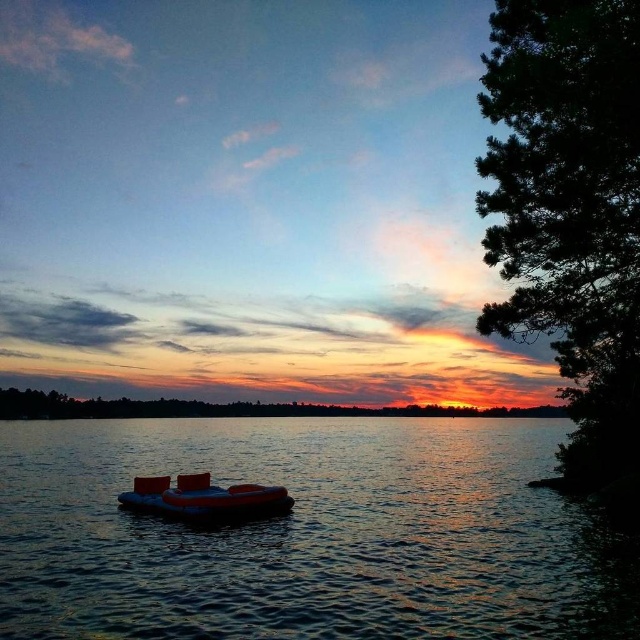
Does translucent rubber boat at center appear over orange rubber boat at center?

Actually, translucent rubber boat at center is below orange rubber boat at center.

Measure the distance between point (108, 620) and camera.

Point (108, 620) is 40.68 feet away from camera.

Find the location of a particular element. translucent rubber boat at center is located at coordinates (305, 532).

Who is more forward, (120, 416) or (205, 497)?

Point (205, 497)

Can you confirm if green leafy tree at center is positioned to the left of orange rubber boat at center?

Correct, you'll find green leafy tree at center to the left of orange rubber boat at center.

This screenshot has width=640, height=640. Find the location of `green leafy tree at center`. green leafy tree at center is located at coordinates (225, 408).

You are a GUI agent. You are given a task and a screenshot of the screen. Output one action in this format:
    pyautogui.click(x=<x>, y=<y>)
    Task: Click on the green textured tree at right
    The image size is (640, 640).
    Given the screenshot: What is the action you would take?
    pyautogui.click(x=570, y=209)

Between point (484, 198) and point (256, 497), which one is positioned in front?

Point (484, 198) is more forward.

The image size is (640, 640). I want to click on green textured tree at right, so click(x=570, y=209).